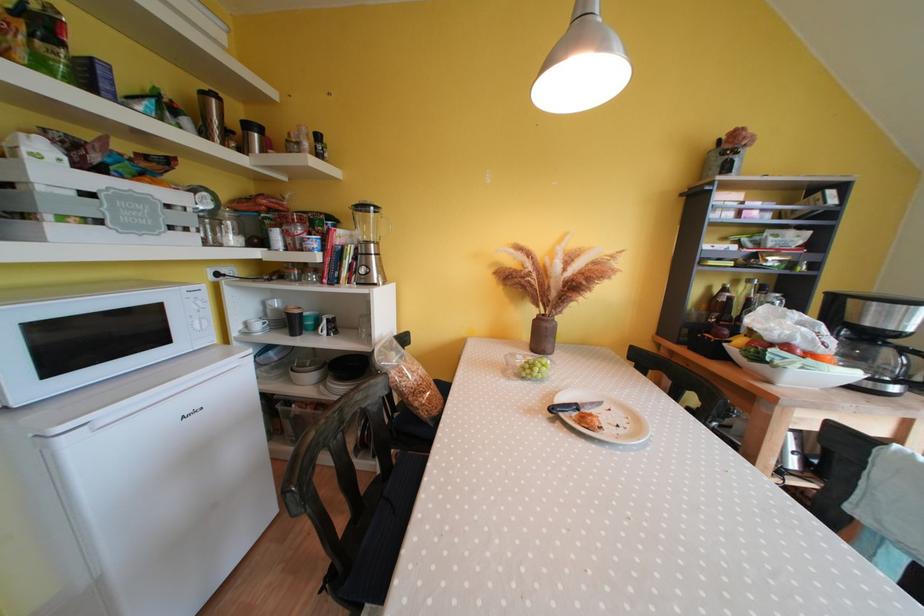
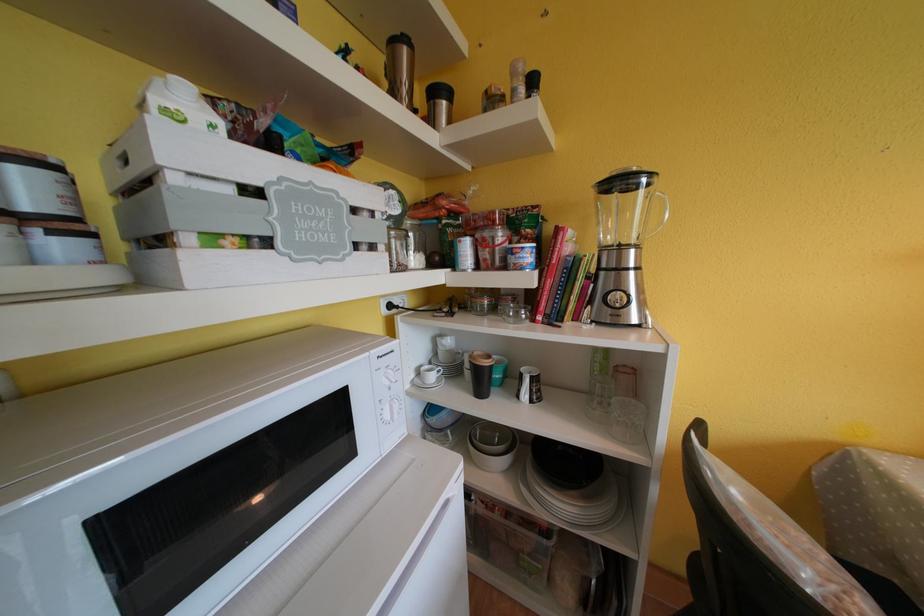
In the second image, find the point that corresponds to point (318, 371) in the first image.

(507, 452)